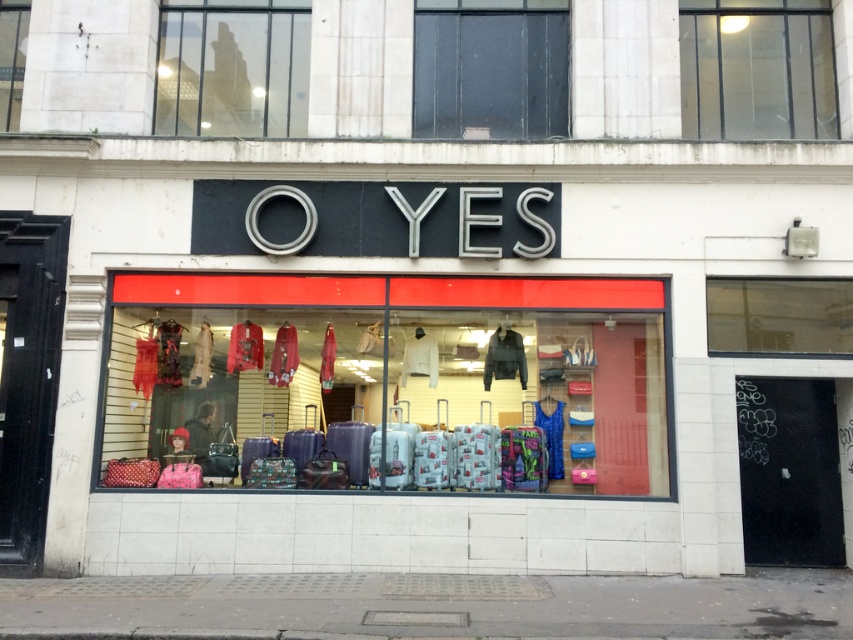
Question: Is matte plastic luggage at center to the right of transparent glass at upper left from the viewer's perspective?

Choices:
 (A) yes
 (B) no

Answer: (A)

Question: Which object appears farthest from the camera in this image?

Choices:
 (A) transparent glass at upper center
 (B) matte plastic luggage at center
 (C) transparent glass at upper left

Answer: (C)

Question: Among these points, which one is nearest to the camera?

Choices:
 (A) (338, 433)
 (B) (693, 99)
 (C) (431, 58)
 (D) (189, 4)

Answer: (A)

Question: Which point is farther to the camera?

Choices:
 (A) transparent glass at upper left
 (B) transparent glass at upper center
 (C) transparent glass at upper right

Answer: (A)

Question: In this image, where is matte plastic luggage at center located relative to transparent glass at upper right?

Choices:
 (A) below
 (B) above

Answer: (A)

Question: Can you confirm if matte plastic luggage at center is positioned to the right of transparent glass at upper right?

Choices:
 (A) yes
 (B) no

Answer: (B)